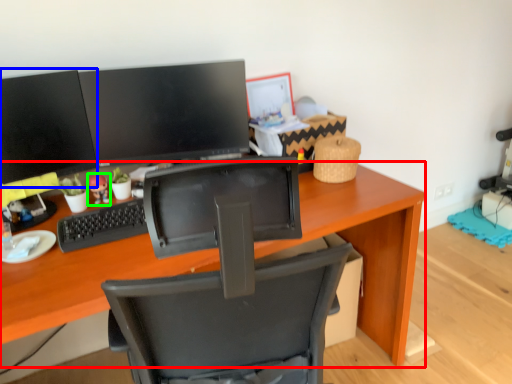
Question: Based on their relative distances, which object is farther from desk (highlighted by a red box)? Choose from computer monitor (highlighted by a blue box) and toy (highlighted by a green box).

Choices:
 (A) computer monitor
 (B) toy

Answer: (B)